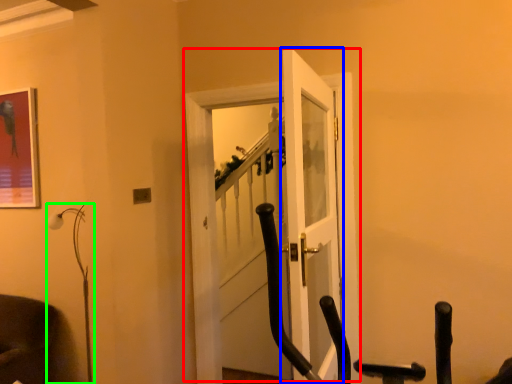
Question: Based on their relative distances, which object is farther from door (highlighted by a red box)? Choose from door (highlighted by a blue box) and lamp (highlighted by a green box).

Choices:
 (A) door
 (B) lamp

Answer: (B)